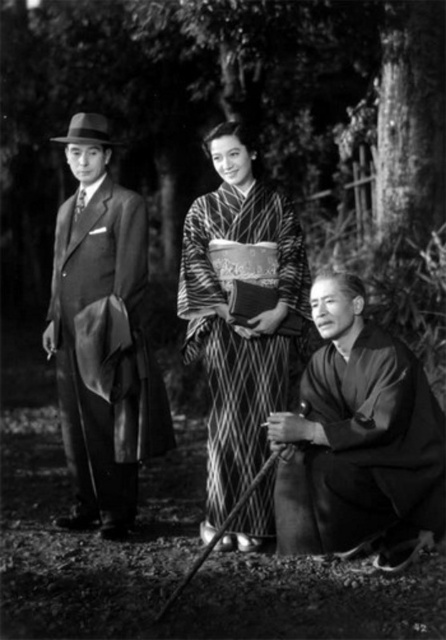
Which of these two, smooth black suit at left or silky kimono at center, stands taller?

With more height is smooth black suit at left.

Does smooth black suit at left lie behind silky kimono at center?

No, smooth black suit at left is in front of silky kimono at center.

Identify the location of smooth black suit at left. This screenshot has height=640, width=446. (103, 337).

The height and width of the screenshot is (640, 446). I want to click on smooth black suit at left, so click(x=103, y=337).

Does smooth black suit at left appear on the right side of silky kimono at lower right?

In fact, smooth black suit at left is to the left of silky kimono at lower right.

Measure the distance between smooth black suit at left and camera.

They are 4.51 meters apart.

Between point (78, 172) and point (421, 506), which one is positioned in front?

Point (421, 506)

You are a GUI agent. You are given a task and a screenshot of the screen. Output one action in this format:
    pyautogui.click(x=<x>, y=<y>)
    Task: Click on the smooth black suit at left
    The height and width of the screenshot is (640, 446).
    Given the screenshot: What is the action you would take?
    pyautogui.click(x=103, y=337)

Is silky kimono at lower right taller than silky kimono at center?

Incorrect, silky kimono at lower right's height is not larger of silky kimono at center's.

Is point (380, 412) positioned behind point (235, 492)?

No, it is in front of (235, 492).

Who is more distant from viewer, (354, 372) or (263, 488)?

The point (263, 488) is more distant.

The height and width of the screenshot is (640, 446). I want to click on silky kimono at lower right, so click(x=363, y=451).